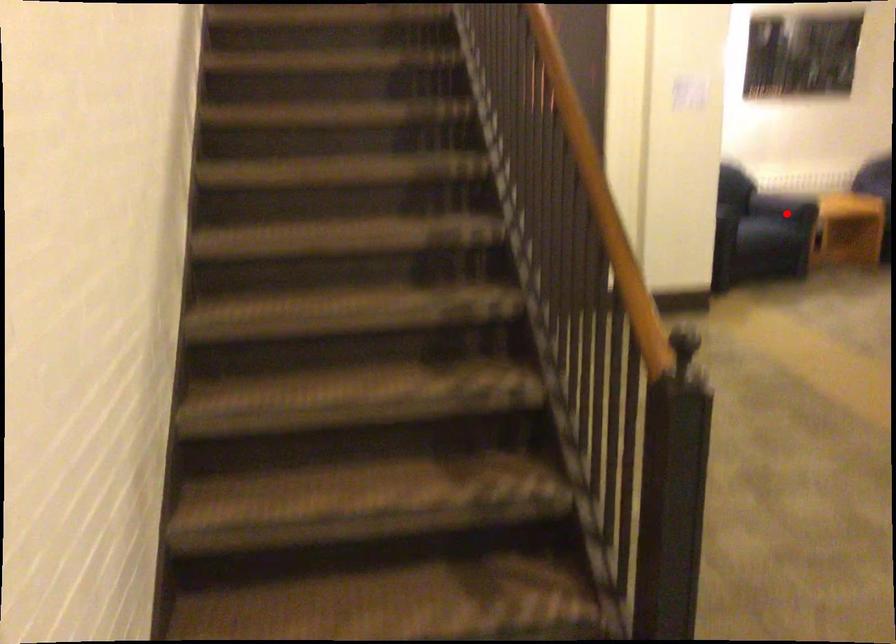
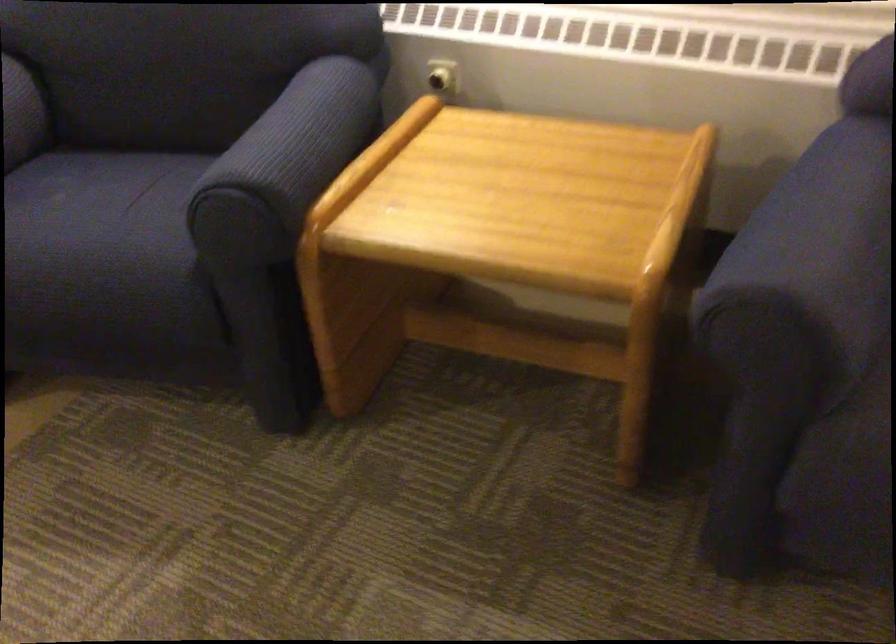
Question: I am providing you with two images of the same scene from different viewpoints. A red point is shown in image1. For the corresponding object point in image2, is it positioned nearer or farther from the camera?

Choices:
 (A) Nearer
 (B) Farther

Answer: (A)